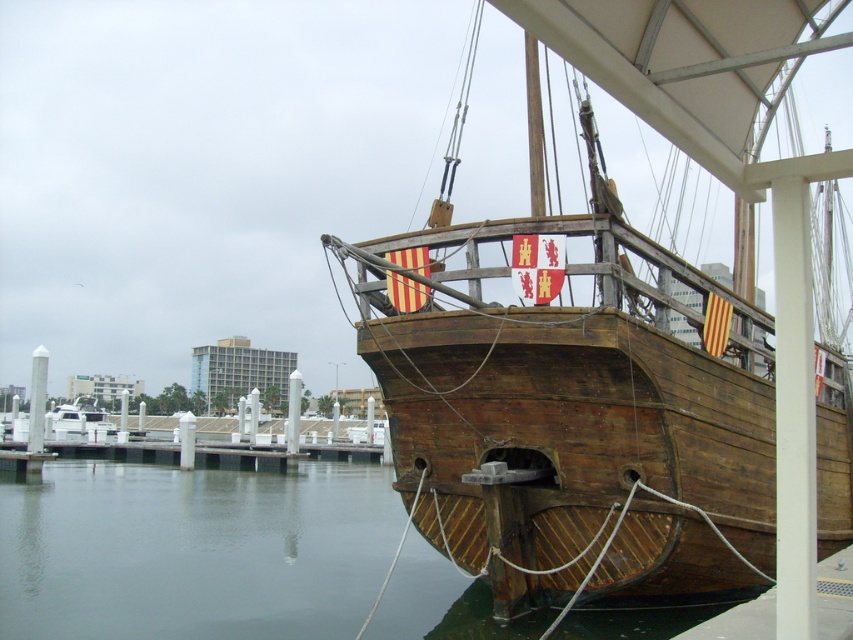
Based on the photo, you are a sailor standing on the deck of the wooden ship at center. You want to jump into the water. Is the wooden water at lower left directly below you?

The wooden ship at center is located above wooden water at lower left, so yes, the wooden water at lower left is directly below the wooden ship at center. You can jump into it.

You are a dock worker who needs to secure the wooden ship at center to the dock using a rope that is 5 meters long. Can you reach the ship with the rope?

The distance between the dock and the wooden ship at center is 5.15 meters, so the 5 meter rope is not long enough to secure the ship. A longer rope is needed.

In the scene shown: You are a sailor on the wooden ship at center. You notice the wooden water at lower left. Which object is taller from your perspective?

The wooden ship at center is taller than the wooden water at lower left.